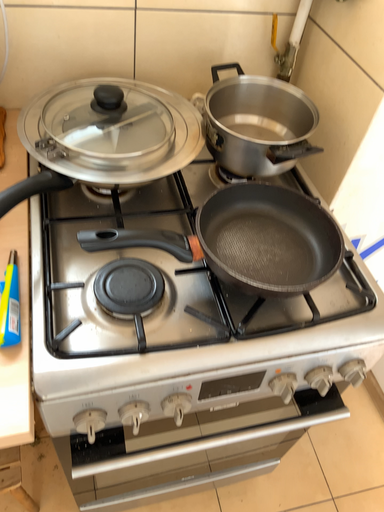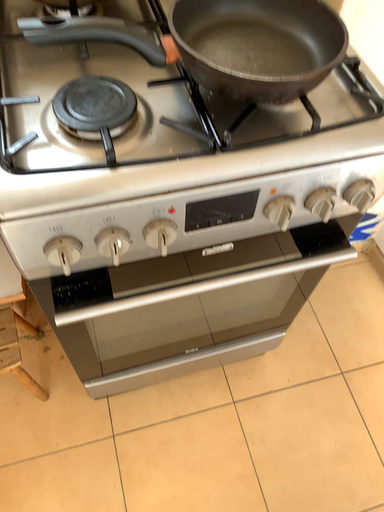
Question: Which way did the camera rotate in the video?

Choices:
 (A) rotated downward
 (B) rotated upward

Answer: (A)